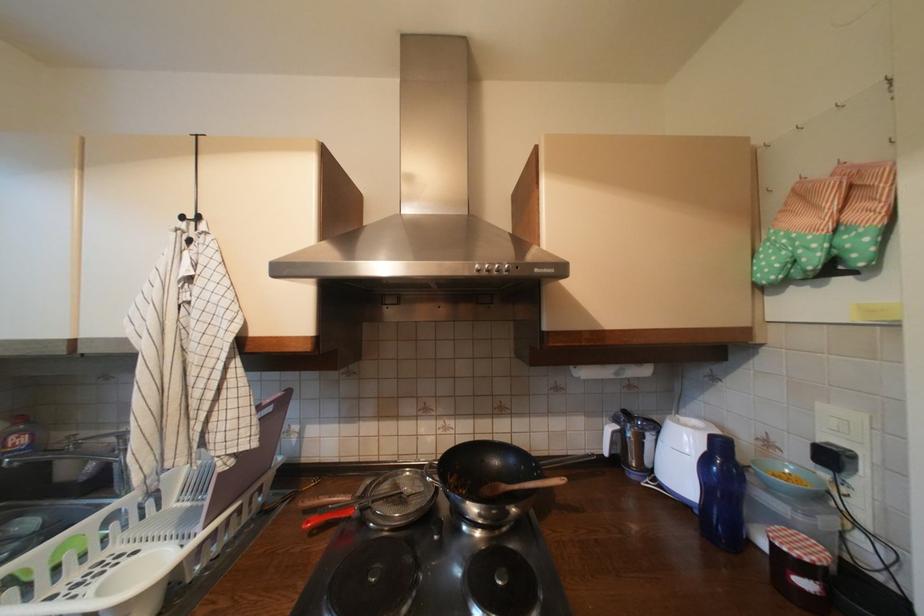
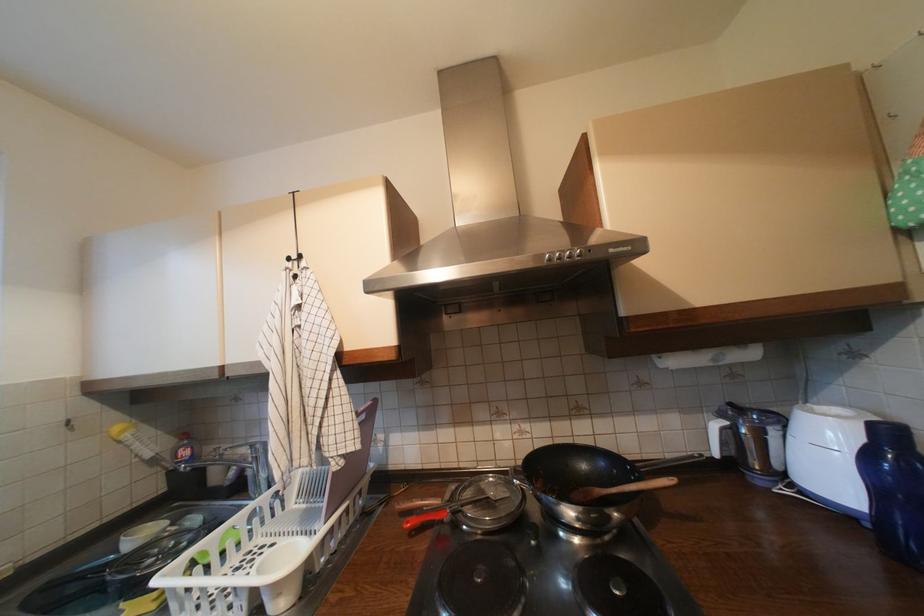
Locate, in the second image, the point that corresponds to (652,439) in the first image.

(774, 435)